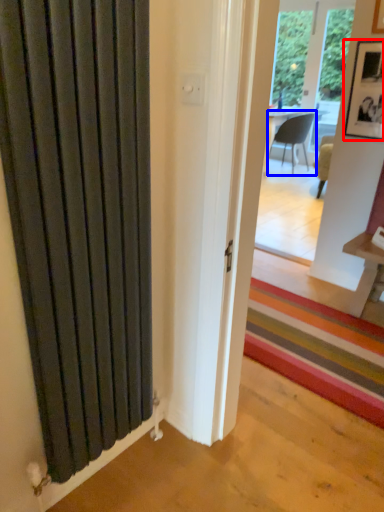
Question: Which object appears farthest to the camera in this image, picture frame (highlighted by a red box) or chair (highlighted by a blue box)?

Choices:
 (A) picture frame
 (B) chair

Answer: (B)